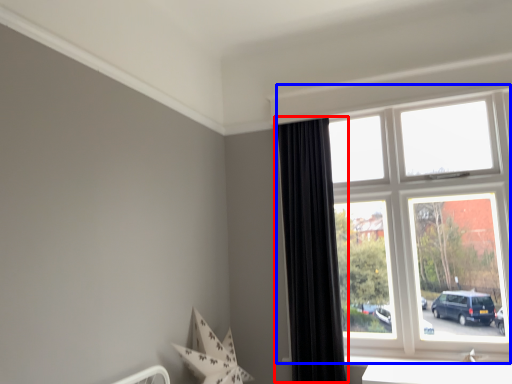
Question: Which of the following is the closest to the observer, curtain (highlighted by a red box) or window (highlighted by a blue box)?

Choices:
 (A) curtain
 (B) window

Answer: (B)